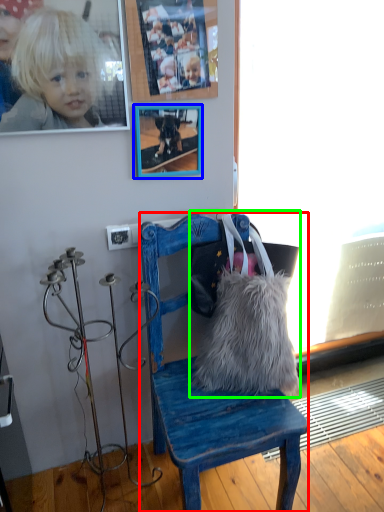
Question: Which object is positioned farthest from chair (highlighted by a red box)? Select from picture frame (highlighted by a blue box) and handbag (highlighted by a green box).

Choices:
 (A) picture frame
 (B) handbag

Answer: (A)